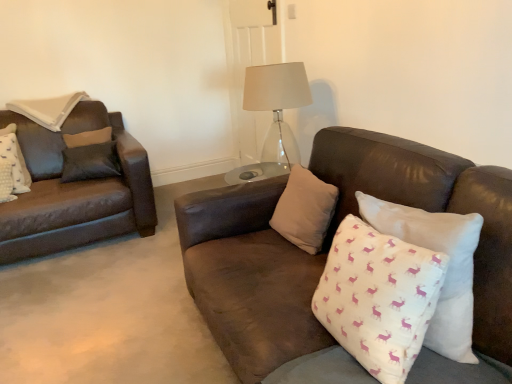
The height and width of the screenshot is (384, 512). Describe the element at coordinates (447, 270) in the screenshot. I see `white cotton pillow with pink deer pattern at center, arranged as the 1th pillow when viewed from the right` at that location.

Locate an element on the screen. Image resolution: width=512 pixels, height=384 pixels. transparent glass table lamp at center is located at coordinates click(x=276, y=87).

Who is shorter, white cotton cushion with pink deer pattern at right, placed as the second pillow when sorted from right to left, or beige fabric pillow at center, acting as the 3th pillow starting from the right?

beige fabric pillow at center, acting as the 3th pillow starting from the right.

Is white cotton cushion with pink deer pattern at right, which is the third pillow in left-to-right order, outside of beige fabric pillow at center, the second pillow from the left?

white cotton cushion with pink deer pattern at right, which is the third pillow in left-to-right order, lies outside beige fabric pillow at center, the second pillow from the left,'s area.

Is point (358, 350) in front of point (302, 204)?

That is True.

Which object is closer to the camera taking this photo, white cotton pillow with pink deer pattern at center, arranged as the 1th pillow when viewed from the right, or transparent glass table lamp at center?

Positioned in front is white cotton pillow with pink deer pattern at center, arranged as the 1th pillow when viewed from the right.

In the scene shown: From the image's perspective, which is above, white cotton pillow with pink deer pattern at center, arranged as the 1th pillow when viewed from the right, or transparent glass table lamp at center?

transparent glass table lamp at center is shown above in the image.

Does white cotton pillow with pink deer pattern at center, the fourth pillow from the left, have a larger size compared to transparent glass table lamp at center?

Incorrect, white cotton pillow with pink deer pattern at center, the fourth pillow from the left, is not larger than transparent glass table lamp at center.

Does white cotton cushion with pink deer pattern at right, placed as the second pillow when sorted from right to left, contain white textured pillow at left, which appears as the 4th pillow when viewed from the right?

No, white textured pillow at left, which appears as the 4th pillow when viewed from the right, is not inside white cotton cushion with pink deer pattern at right, placed as the second pillow when sorted from right to left.

Which is nearer, (x=429, y=306) or (x=3, y=183)?

Point (x=429, y=306) is positioned closer to the camera compared to point (x=3, y=183).

From a real-world perspective, which is physically above, white cotton cushion with pink deer pattern at right, which is the third pillow in left-to-right order, or white textured pillow at left, which is counted as the first pillow, starting from the left?

In real-world perspective, white cotton cushion with pink deer pattern at right, which is the third pillow in left-to-right order, is above.

Measure the distance between white cotton cushion with pink deer pattern at right, which is the third pillow in left-to-right order, and white textured pillow at left, which appears as the 4th pillow when viewed from the right.

white cotton cushion with pink deer pattern at right, which is the third pillow in left-to-right order, is 2.22 meters away from white textured pillow at left, which appears as the 4th pillow when viewed from the right.

From the image's perspective, which is below, white textured pillow at left, which appears as the 4th pillow when viewed from the right, or white cotton cushion with pink deer pattern at right, which is the third pillow in left-to-right order?

From the image's view, white cotton cushion with pink deer pattern at right, which is the third pillow in left-to-right order, is below.

Can you see white textured pillow at left, which is counted as the first pillow, starting from the left, touching white cotton cushion with pink deer pattern at right, placed as the second pillow when sorted from right to left?

white textured pillow at left, which is counted as the first pillow, starting from the left, is not next to white cotton cushion with pink deer pattern at right, placed as the second pillow when sorted from right to left, and they're not touching.

Considering the relative positions of white textured pillow at left, which is counted as the first pillow, starting from the left, and white cotton cushion with pink deer pattern at right, which is the third pillow in left-to-right order, in the image provided, is white textured pillow at left, which is counted as the first pillow, starting from the left, behind white cotton cushion with pink deer pattern at right, which is the third pillow in left-to-right order,?

Yes, the depth of white textured pillow at left, which is counted as the first pillow, starting from the left, is greater than that of white cotton cushion with pink deer pattern at right, which is the third pillow in left-to-right order.

Is white textured pillow at left, which is counted as the first pillow, starting from the left, inside the boundaries of white cotton cushion with pink deer pattern at right, which is the third pillow in left-to-right order, or outside?

white textured pillow at left, which is counted as the first pillow, starting from the left, is outside white cotton cushion with pink deer pattern at right, which is the third pillow in left-to-right order.

Is white cotton cushion with pink deer pattern at right, placed as the second pillow when sorted from right to left, facing away from transparent glass table lamp at center?

No.

Measure the distance from white cotton cushion with pink deer pattern at right, placed as the second pillow when sorted from right to left, to transparent glass table lamp at center.

white cotton cushion with pink deer pattern at right, placed as the second pillow when sorted from right to left, is 4.01 feet from transparent glass table lamp at center.

From the image's perspective, starting from the transparent glass table lamp at center, which pillow is the 4th one below? Please provide its 2D coordinates.

[(378, 297)]

Considering the relative sizes of transparent glass table lamp at center and beige fabric pillow at center, the second pillow from the left, in the image provided, is transparent glass table lamp at center taller than beige fabric pillow at center, the second pillow from the left,?

Yes.

From the picture: Is transparent glass table lamp at center in front of or behind beige fabric pillow at center, acting as the 3th pillow starting from the right, in the image?

transparent glass table lamp at center is behind beige fabric pillow at center, acting as the 3th pillow starting from the right.

Measure the distance from transparent glass table lamp at center to beige fabric pillow at center, acting as the 3th pillow starting from the right.

transparent glass table lamp at center is 24.08 inches away from beige fabric pillow at center, acting as the 3th pillow starting from the right.

Is transparent glass table lamp at center wider than beige fabric pillow at center, acting as the 3th pillow starting from the right?

Indeed, transparent glass table lamp at center has a greater width compared to beige fabric pillow at center, acting as the 3th pillow starting from the right.

Which point is more forward, (424, 222) or (359, 218)?

Point (424, 222)

In the scene shown: Which of these two, white cotton pillow with pink deer pattern at center, the fourth pillow from the left, or white cotton cushion with pink deer pattern at right, which is the third pillow in left-to-right order, stands shorter?

white cotton cushion with pink deer pattern at right, which is the third pillow in left-to-right order.

Is white cotton pillow with pink deer pattern at center, arranged as the 1th pillow when viewed from the right, situated inside white cotton cushion with pink deer pattern at right, which is the third pillow in left-to-right order, or outside?

white cotton pillow with pink deer pattern at center, arranged as the 1th pillow when viewed from the right, is enclosed within white cotton cushion with pink deer pattern at right, which is the third pillow in left-to-right order.

Where is `the 1st pillow to the left when counting from the white cotton cushion with pink deer pattern at right, placed as the second pillow when sorted from right to left`? The height and width of the screenshot is (384, 512). the 1st pillow to the left when counting from the white cotton cushion with pink deer pattern at right, placed as the second pillow when sorted from right to left is located at coordinates (305, 210).

Identify the location of the 3rd pillow counting from the right of the transparent glass table lamp at center. (447, 270).

Estimate the real-world distances between objects in this image. Which object is further from white textured pillow at left, which is counted as the first pillow, starting from the left, beige fabric pillow at center, the second pillow from the left, or white cotton cushion with pink deer pattern at right, which is the third pillow in left-to-right order?

The object further to white textured pillow at left, which is counted as the first pillow, starting from the left, is white cotton cushion with pink deer pattern at right, which is the third pillow in left-to-right order.

Looking at the image, which one is located further to white cotton cushion with pink deer pattern at right, placed as the second pillow when sorted from right to left, white textured pillow at left, which is counted as the first pillow, starting from the left, or white cotton pillow with pink deer pattern at center, arranged as the 1th pillow when viewed from the right?

Based on the image, white textured pillow at left, which is counted as the first pillow, starting from the left, appears to be further to white cotton cushion with pink deer pattern at right, placed as the second pillow when sorted from right to left.

Which object lies further to the anchor point white cotton pillow with pink deer pattern at center, arranged as the 1th pillow when viewed from the right, beige fabric pillow at center, the second pillow from the left, or transparent glass table lamp at center?

The object further to white cotton pillow with pink deer pattern at center, arranged as the 1th pillow when viewed from the right, is transparent glass table lamp at center.

Which object lies nearer to the anchor point beige fabric pillow at center, acting as the 3th pillow starting from the right, white cotton pillow with pink deer pattern at center, the fourth pillow from the left, or white textured pillow at left, which is counted as the first pillow, starting from the left?

white cotton pillow with pink deer pattern at center, the fourth pillow from the left.

Looking at this image, estimate the real-world distances between objects in this image. Which object is further from beige fabric pillow at center, the second pillow from the left, transparent glass table lamp at center or white cotton cushion with pink deer pattern at right, which is the third pillow in left-to-right order?

transparent glass table lamp at center lies further to beige fabric pillow at center, the second pillow from the left, than the other object.

From the image, which object appears to be nearer to white cotton cushion with pink deer pattern at right, placed as the second pillow when sorted from right to left, beige fabric pillow at center, the second pillow from the left, or white textured pillow at left, which is counted as the first pillow, starting from the left?

beige fabric pillow at center, the second pillow from the left, lies closer to white cotton cushion with pink deer pattern at right, placed as the second pillow when sorted from right to left, than the other object.

Based on their spatial positions, is beige fabric pillow at center, acting as the 3th pillow starting from the right, or transparent glass table lamp at center further from white textured pillow at left, which appears as the 4th pillow when viewed from the right?

beige fabric pillow at center, acting as the 3th pillow starting from the right, is further to white textured pillow at left, which appears as the 4th pillow when viewed from the right.

Estimate the real-world distances between objects in this image. Which object is closer to transparent glass table lamp at center, white cotton pillow with pink deer pattern at center, arranged as the 1th pillow when viewed from the right, or white cotton cushion with pink deer pattern at right, placed as the second pillow when sorted from right to left?

white cotton pillow with pink deer pattern at center, arranged as the 1th pillow when viewed from the right, lies closer to transparent glass table lamp at center than the other object.

This screenshot has height=384, width=512. Find the location of `table lamp between white textured pillow at left, which appears as the 4th pillow when viewed from the right, and white cotton cushion with pink deer pattern at right, placed as the second pillow when sorted from right to left, from left to right`. table lamp between white textured pillow at left, which appears as the 4th pillow when viewed from the right, and white cotton cushion with pink deer pattern at right, placed as the second pillow when sorted from right to left, from left to right is located at coordinates (276, 87).

Identify the location of table lamp between white textured pillow at left, which appears as the 4th pillow when viewed from the right, and beige fabric pillow at center, acting as the 3th pillow starting from the right. (276, 87).

Locate an element on the screen. The height and width of the screenshot is (384, 512). table lamp between white textured pillow at left, which is counted as the first pillow, starting from the left, and white cotton pillow with pink deer pattern at center, arranged as the 1th pillow when viewed from the right, from left to right is located at coordinates (276, 87).

Find the location of a particular element. pillow between white textured pillow at left, which is counted as the first pillow, starting from the left, and white cotton cushion with pink deer pattern at right, which is the third pillow in left-to-right order, in the horizontal direction is located at coordinates (305, 210).